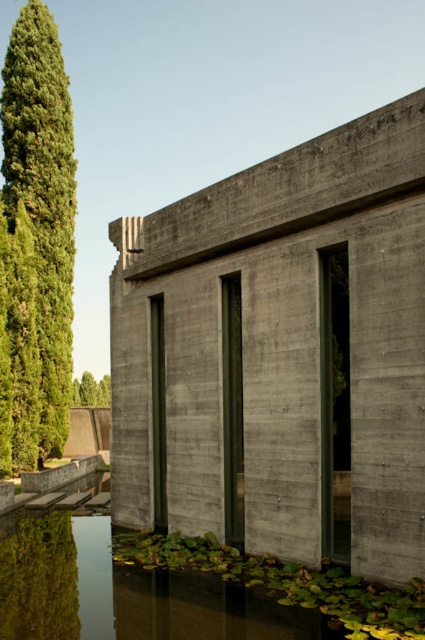
You are an architect evaluating the building. Based on the scene, which object between the gray concrete wall at center and the green mossy water at lower center has a greater height?

The gray concrete wall at center is much taller than the green mossy water at lower center, so the gray concrete wall at center has a greater height.